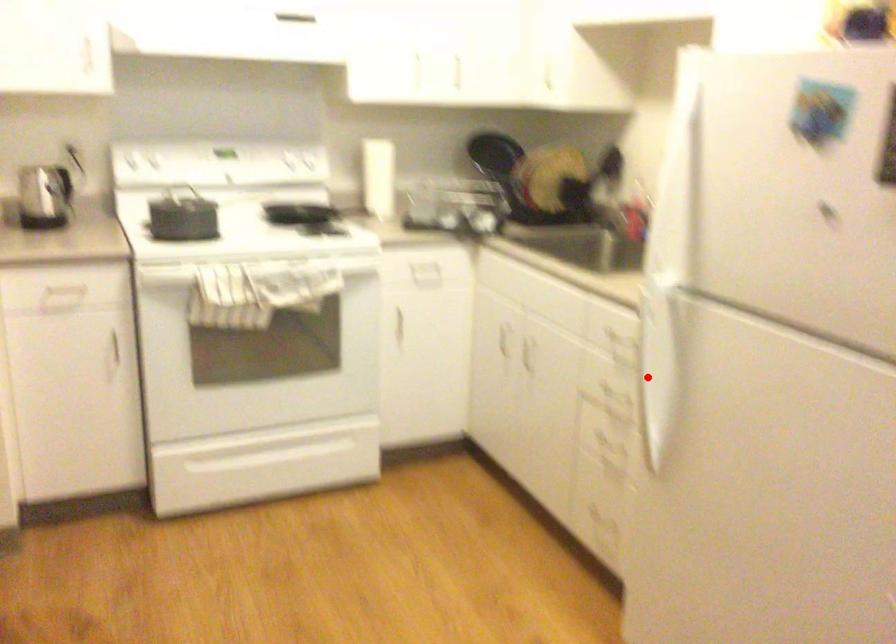
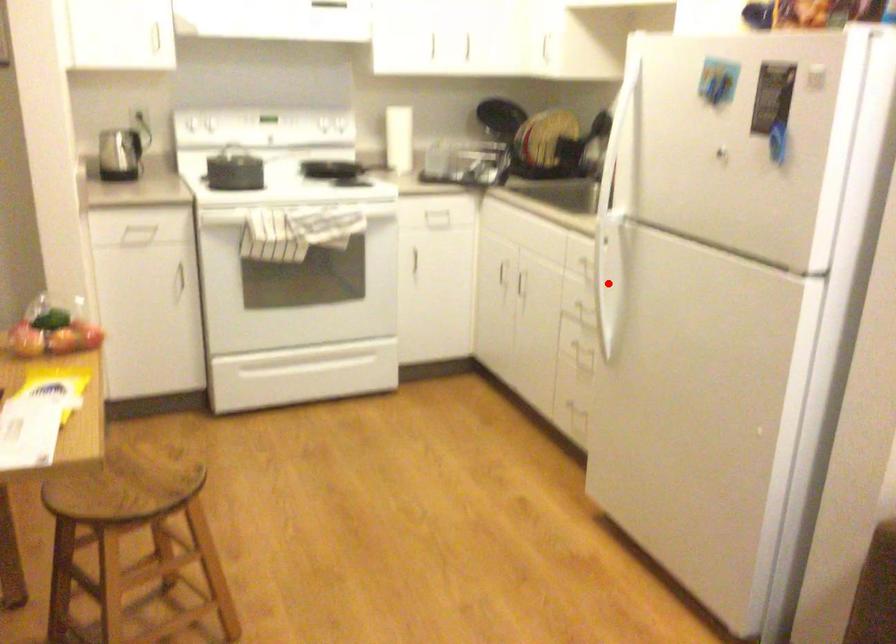
I am providing you with two images of the same scene from different viewpoints. A red point is marked on the first image and another point is marked on the second image. Is the marked point in image1 the same physical position as the marked point in image2?

Yes